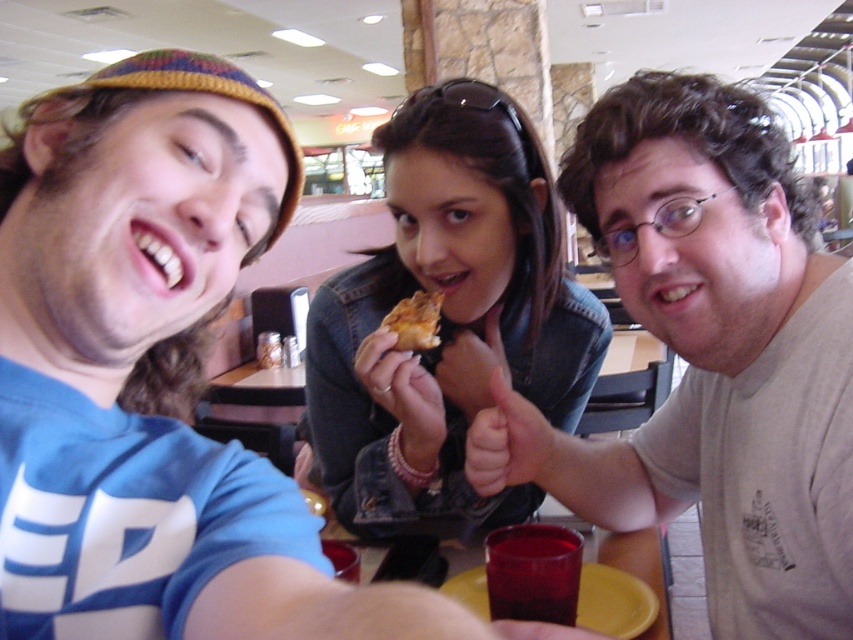
Question: Can you confirm if yellow plastic plate at lower center is positioned to the left of golden crispy pizza slice at center?

Choices:
 (A) yes
 (B) no

Answer: (B)

Question: Does matte blue t-shirt at center appear over golden crispy pizza slice at center?

Choices:
 (A) no
 (B) yes

Answer: (A)

Question: Which object is the farthest from the matte gray t-shirt at center?

Choices:
 (A) matte blue t-shirt at center
 (B) denim jacket at center
 (C) golden crispy pizza slice at center

Answer: (A)

Question: Among these objects, which one is farthest from the camera?

Choices:
 (A) matte blue t-shirt at center
 (B) golden crispy pizza slice at center

Answer: (B)

Question: Is matte blue t-shirt at center thinner than golden crispy pizza slice at center?

Choices:
 (A) yes
 (B) no

Answer: (B)

Question: Which point is closer to the camera?

Choices:
 (A) yellow plastic plate at lower center
 (B) matte gray t-shirt at center

Answer: (B)